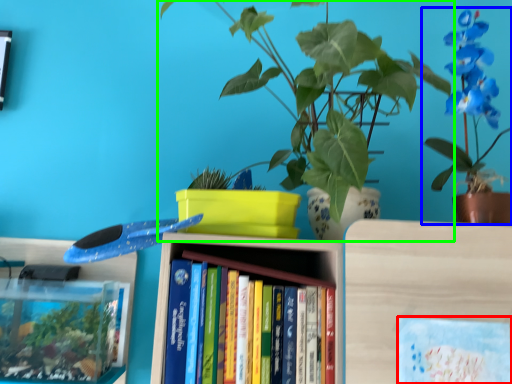
Question: Which object is the closest to the book cover (highlighted by a red box)? Choose among these: houseplant (highlighted by a blue box) or houseplant (highlighted by a green box).

Choices:
 (A) houseplant
 (B) houseplant

Answer: (A)